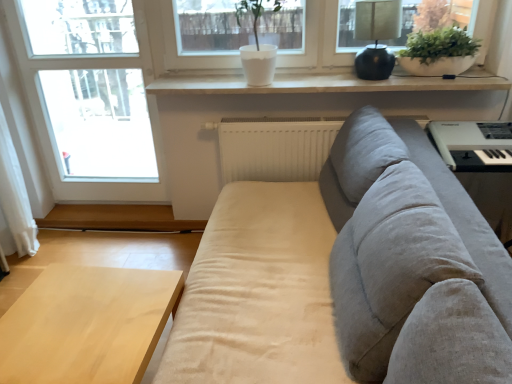
The width and height of the screenshot is (512, 384). What are the coordinates of `blank space situated above white matte radiator at center (from a real-world perspective)` in the screenshot? It's located at pyautogui.click(x=324, y=112).